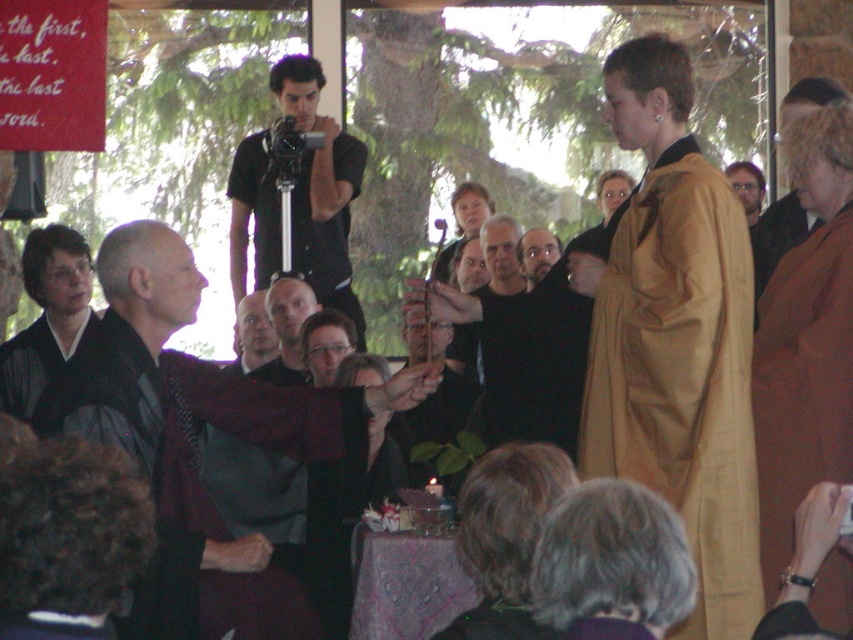
You are a photographer at the event and need to place both the black matte camera at center and the black matte violin at center on a shelf that can only hold items up to 30 cm in width. Given their sizes, can both items fit on the shelf together?

The black matte camera at center is wider than the black matte violin at center. However, without knowing the exact widths of both items, it is impossible to determine if their combined width exceeds the 30 cm limit. More information is needed.